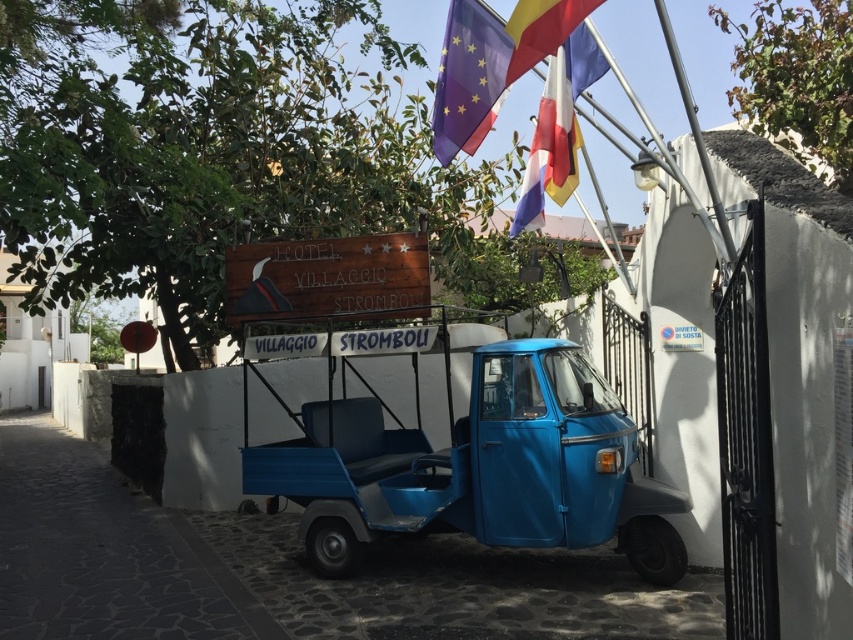
Question: Is blue plastic tuk-tuk at center smaller than purple fabric flag at upper center?

Choices:
 (A) no
 (B) yes

Answer: (A)

Question: Is purple fabric flag at upper center to the right of blue fabric flag at upper center from the viewer's perspective?

Choices:
 (A) no
 (B) yes

Answer: (A)

Question: Which object is farther from the camera taking this photo?

Choices:
 (A) purple fabric flag at upper center
 (B) yellow fabric flag at upper center
 (C) blue matte truck at center

Answer: (C)

Question: Which is farther from the blue matte truck at center?

Choices:
 (A) purple fabric flag at upper center
 (B) yellow fabric flag at upper center
 (C) blue fabric flag at upper center
 (D) blue plastic tuk-tuk at center

Answer: (B)

Question: Where is blue plastic tuk-tuk at center located in relation to yellow fabric flag at upper center in the image?

Choices:
 (A) below
 (B) above

Answer: (A)

Question: Estimate the real-world distances between objects in this image. Which object is closer to the purple fabric flag at upper center?

Choices:
 (A) blue matte truck at center
 (B) yellow fabric flag at upper center
 (C) blue plastic tuk-tuk at center

Answer: (B)